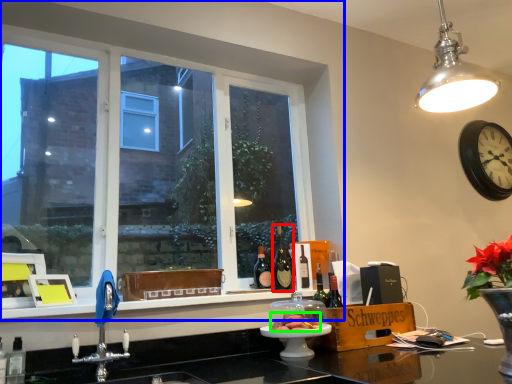
Question: Which is farther away from bottle (highlighted by a red box)? window (highlighted by a blue box) or food (highlighted by a green box)?

Choices:
 (A) window
 (B) food

Answer: (A)